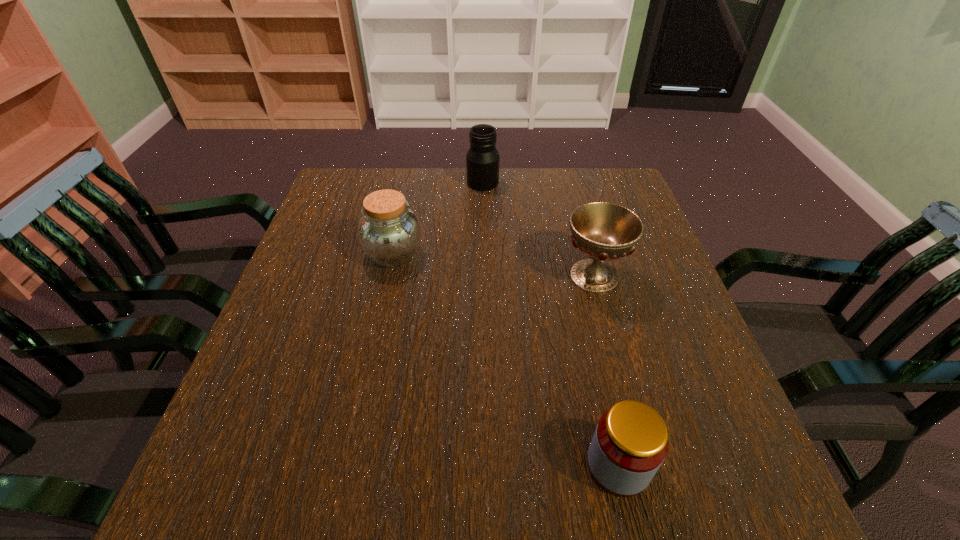
The width and height of the screenshot is (960, 540). What are the coordinates of `free space located 0.140m on the back of the rightmost jar` in the screenshot? It's located at tap(596, 368).

The width and height of the screenshot is (960, 540). What are the coordinates of `object positioned at the far edge` in the screenshot? It's located at (482, 159).

Image resolution: width=960 pixels, height=540 pixels. Find the location of `object at the near edge`. object at the near edge is located at coordinates (630, 443).

At what (x,y) coordinates should I click in order to perform the action: click on object located at the left edge. Please return your answer as a coordinate pair (x, y). The height and width of the screenshot is (540, 960). Looking at the image, I should click on pyautogui.click(x=389, y=232).

The height and width of the screenshot is (540, 960). I want to click on object present at the right edge, so click(x=603, y=231).

This screenshot has height=540, width=960. Find the location of `free spot at the far edge of the desktop`. free spot at the far edge of the desktop is located at coordinates (561, 173).

Identify the location of vacant space at the near edge of the desktop. The height and width of the screenshot is (540, 960). (525, 503).

Where is `vacant space at the left edge of the desktop`? This screenshot has width=960, height=540. vacant space at the left edge of the desktop is located at coordinates (342, 264).

This screenshot has width=960, height=540. In order to click on vacant space at the right edge in this screenshot , I will do `click(686, 350)`.

In the image, there is a desktop. Find the location of `vacant area at the far right corner`. vacant area at the far right corner is located at coordinates (603, 200).